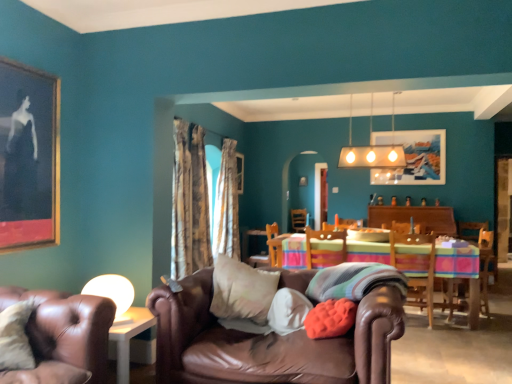
Locate an element on the screen. The image size is (512, 384). wooden chair at center, placed as the third chair when sorted from right to left is located at coordinates (267, 240).

What do you see at coordinates (269, 342) in the screenshot?
I see `brown leather couch at center` at bounding box center [269, 342].

In order to face matte gold rectangular light fixture at upper center, should I rotate leftwards or rightwards?

To face it directly, rotate right by 15.296 degrees.

Measure the distance between soft beige cushion at center, marked as the first pillow in a left-to-right arrangement, and camera.

The distance of soft beige cushion at center, marked as the first pillow in a left-to-right arrangement, from camera is 8.43 feet.

This screenshot has width=512, height=384. I want to click on brown leather couch at lower left, which is the first chair in left-to-right order, so click(63, 336).

Measure the distance between point (315, 330) and camera.

7.96 feet.

You are a GUI agent. You are given a task and a screenshot of the screen. Output one action in this format:
    pyautogui.click(x=<x>, y=<y>)
    Task: Click on the gold-framed painting at upper left, which appears as the 3th picture frame when viewed from the right
    The height and width of the screenshot is (384, 512).
    Given the screenshot: What is the action you would take?
    click(29, 157)

Does soft coral cushion at center, positioned as the second pillow in right-to-left order, have a greater width compared to multicolored woven tablecloth at center?

Incorrect, the width of soft coral cushion at center, positioned as the second pillow in right-to-left order, does not surpass that of multicolored woven tablecloth at center.

From the image's perspective, starting from the multicolored woven tablecloth at center, which pillow is the 2nd one above? Please provide its 2D coordinates.

[(330, 318)]

From the image's perspective, which is above, soft coral cushion at center, positioned as the second pillow in right-to-left order, or multicolored woven tablecloth at center?

soft coral cushion at center, positioned as the second pillow in right-to-left order.

Which object is closer to the camera taking this photo, soft coral cushion at center, positioned as the third pillow in left-to-right order, or multicolored woven tablecloth at center?

soft coral cushion at center, positioned as the third pillow in left-to-right order.

Visually, is wooden chair at right, placed as the fourth chair when sorted from left to right, positioned to the left or to the right of wooden chair at center, which is the third chair in front-to-back order?

In the image, wooden chair at right, placed as the fourth chair when sorted from left to right, appears on the right side of wooden chair at center, which is the third chair in front-to-back order.

From a real-world perspective, is wooden chair at right, positioned as the second chair in front-to-back order, positioned under wooden chair at center, the 2th chair in the right-to-left sequence, based on gravity?

Indeed, from a real-world perspective, wooden chair at right, positioned as the second chair in front-to-back order, is positioned beneath wooden chair at center, the 2th chair in the right-to-left sequence.

Measure the distance from wooden chair at right, the 3th chair viewed from the back, to wooden chair at center, the 2th chair positioned from the back.

wooden chair at right, the 3th chair viewed from the back, is 4.18 feet away from wooden chair at center, the 2th chair positioned from the back.

This screenshot has width=512, height=384. I want to click on the 1st picture frame to the left of the brown leather couch at center, counting from the anchor's position, so click(240, 172).

Is wooden picture frame at center, marked as the 2th picture frame in a right-to-left arrangement, looking in the opposite direction of brown leather couch at center?

No, wooden picture frame at center, marked as the 2th picture frame in a right-to-left arrangement,'s orientation is not away from brown leather couch at center.

From a real-world perspective, is wooden picture frame at center, marked as the 2th picture frame in a right-to-left arrangement, physically below brown leather couch at center?

No, from a real-world perspective, wooden picture frame at center, marked as the 2th picture frame in a right-to-left arrangement, is not beneath brown leather couch at center.

Considering the relative sizes of brown leather couch at center and wooden chair at right, placed as the first chair when sorted from right to left, in the image provided, is brown leather couch at center taller than wooden chair at right, placed as the first chair when sorted from right to left,?

Yes.

From the brown leather couch at center, count 2nd chair to the right and point to it. Please provide its 2D coordinates.

[(416, 268)]

From a real-world perspective, is brown leather couch at center physically located above or below wooden chair at right, placed as the first chair when sorted from right to left?

In terms of real-world spatial position, brown leather couch at center is below wooden chair at right, placed as the first chair when sorted from right to left.

Which object is further away from the camera taking this photo, brown leather couch at center or wooden chair at right, placed as the fourth chair when sorted from left to right?

Positioned behind is wooden chair at right, placed as the fourth chair when sorted from left to right.

Considering the relative sizes of striped fabric pillow at center, placed as the 4th pillow when sorted from left to right, and wooden chair at right, the 3th chair viewed from the back, in the image provided, is striped fabric pillow at center, placed as the 4th pillow when sorted from left to right, smaller than wooden chair at right, the 3th chair viewed from the back,?

Yes.

Is striped fabric pillow at center, placed as the 4th pillow when sorted from left to right, far from wooden chair at right, positioned as the second chair in front-to-back order?

Indeed, striped fabric pillow at center, placed as the 4th pillow when sorted from left to right, is not near wooden chair at right, positioned as the second chair in front-to-back order.

Is striped fabric pillow at center, placed as the 4th pillow when sorted from left to right, oriented away from wooden chair at right, positioned as the second chair in front-to-back order?

Yes, wooden chair at right, positioned as the second chair in front-to-back order, is at the back of striped fabric pillow at center, placed as the 4th pillow when sorted from left to right.

Can you confirm if striped fabric pillow at center, positioned as the first pillow in right-to-left order, is positioned to the right of wooden chair at right, placed as the first chair when sorted from right to left?

No.

Where is `studio couch that appears in front of the wooden chair at center, positioned as the second chair in left-to-right order`? The width and height of the screenshot is (512, 384). studio couch that appears in front of the wooden chair at center, positioned as the second chair in left-to-right order is located at coordinates (269, 342).

Considering the points (267, 234) and (243, 357), which point is in front, point (267, 234) or point (243, 357)?

Point (243, 357)

Is wooden chair at center, arranged as the 1th chair when viewed from the back, placed right next to brown leather couch at center?

There is a gap between wooden chair at center, arranged as the 1th chair when viewed from the back, and brown leather couch at center.

Between brown leather couch at lower left, which appears as the fourth chair when viewed from the back, and silky white curtain at center, which is counted as the first curtain, starting from the back, which one is positioned in front?

brown leather couch at lower left, which appears as the fourth chair when viewed from the back, is more forward.

Is brown leather couch at lower left, the 1th chair viewed from the front, positioned beyond the bounds of silky white curtain at center, arranged as the second curtain when viewed from the left?

brown leather couch at lower left, the 1th chair viewed from the front, lies outside silky white curtain at center, arranged as the second curtain when viewed from the left,'s area.

Is brown leather couch at lower left, which is the first chair in left-to-right order, aimed at silky white curtain at center, arranged as the second curtain when viewed from the left?

No.

Looking at this image, is the surface of brown leather couch at lower left, the fourth chair from the right, in direct contact with silky white curtain at center, the first curtain when ordered from right to left?

No, brown leather couch at lower left, the fourth chair from the right, is not beside silky white curtain at center, the first curtain when ordered from right to left.

From a real-world perspective, starting from the multicolored woven tablecloth at center, which pillow is the 2nd one vertically above it? Please provide its 2D coordinates.

[(330, 318)]

Image resolution: width=512 pixels, height=384 pixels. What are the coordinates of `chair that is the 1st object located below the wooden chair at center, the 2th chair positioned from the back (from the image's perspective)` in the screenshot? It's located at (416, 268).

Which object lies nearer to the anchor point wooden chair at center, the 2th chair positioned from the back, wooden chair at center, arranged as the 1th chair when viewed from the back, or floral fabric curtain at center, the first curtain positioned from the front?

wooden chair at center, arranged as the 1th chair when viewed from the back, is closer to wooden chair at center, the 2th chair positioned from the back.

Which object lies further to the anchor point soft beige cushion at center, marked as the first pillow in a left-to-right arrangement, brown leather couch at center or brown leather couch at lower left, which appears as the fourth chair when viewed from the back?

brown leather couch at lower left, which appears as the fourth chair when viewed from the back, lies further to soft beige cushion at center, marked as the first pillow in a left-to-right arrangement, than the other object.

Which object lies further to the anchor point wooden framed artwork at upper center, the second picture frame in the back-to-front sequence, matte gold rectangular light fixture at upper center or gold-framed painting at upper left, which is the first picture frame in front-to-back order?

Among the two, gold-framed painting at upper left, which is the first picture frame in front-to-back order, is located further to wooden framed artwork at upper center, the second picture frame in the back-to-front sequence.

Considering their positions, is brown leather couch at center positioned closer to brown leather couch at lower left, the fourth chair from the right, than floral fabric curtain at center, the first curtain positioned from the front?

brown leather couch at center is closer to brown leather couch at lower left, the fourth chair from the right.

Which object lies further to the anchor point matte gold rectangular light fixture at upper center, wooden chair at right, placed as the first chair when sorted from right to left, or brown leather couch at center?

Based on the image, brown leather couch at center appears to be further to matte gold rectangular light fixture at upper center.

Considering their positions, is soft coral cushion at center, positioned as the second pillow in right-to-left order, positioned further to soft beige cushion at center, marked as the first pillow in a left-to-right arrangement, than wooden chair at center, which is the third chair in front-to-back order?

wooden chair at center, which is the third chair in front-to-back order, is further to soft beige cushion at center, marked as the first pillow in a left-to-right arrangement.

Looking at the image, which one is located closer to white soft pillow at center, which ranks as the 2th pillow in left-to-right order, wooden framed artwork at upper center, which ranks as the first picture frame in right-to-left order, or silky white curtain at center, arranged as the second curtain when viewed from the left?

wooden framed artwork at upper center, which ranks as the first picture frame in right-to-left order, is positioned closer to the anchor white soft pillow at center, which ranks as the 2th pillow in left-to-right order.

Looking at the image, which one is located closer to striped fabric pillow at center, positioned as the first pillow in right-to-left order, gold-framed painting at upper left, the 3th picture frame viewed from the back, or matte gold rectangular light fixture at upper center?

gold-framed painting at upper left, the 3th picture frame viewed from the back, is positioned closer to the anchor striped fabric pillow at center, positioned as the first pillow in right-to-left order.

I want to click on curtain positioned between brown leather couch at lower left, the fourth chair from the right, and matte gold rectangular light fixture at upper center from near to far, so click(x=190, y=202).

Where is `kitchen & dining room table positioned between soft coral cushion at center, positioned as the second pillow in right-to-left order, and wooden chair at right, placed as the first chair when sorted from right to left, from near to far`? kitchen & dining room table positioned between soft coral cushion at center, positioned as the second pillow in right-to-left order, and wooden chair at right, placed as the first chair when sorted from right to left, from near to far is located at coordinates (461, 272).

This screenshot has height=384, width=512. I want to click on lamp between floral fabric curtain at center, the first curtain positioned from the front, and wooden framed artwork at upper center, which ranks as the first picture frame in right-to-left order, so click(x=371, y=154).

Where is `pillow between white soft pillow at center, the 3th pillow viewed from the right, and multicolored woven tablecloth at center in the front-back direction`? pillow between white soft pillow at center, the 3th pillow viewed from the right, and multicolored woven tablecloth at center in the front-back direction is located at coordinates (242, 295).